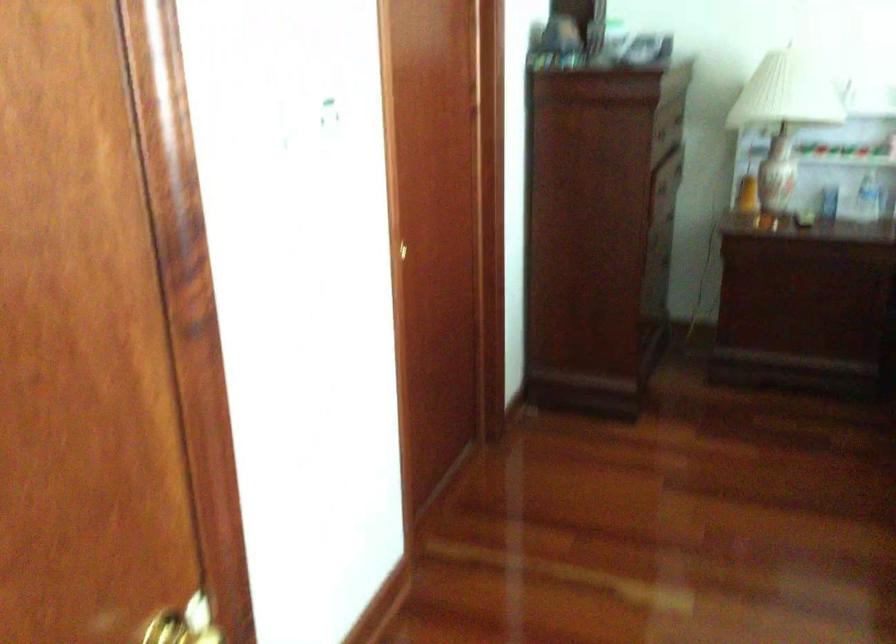
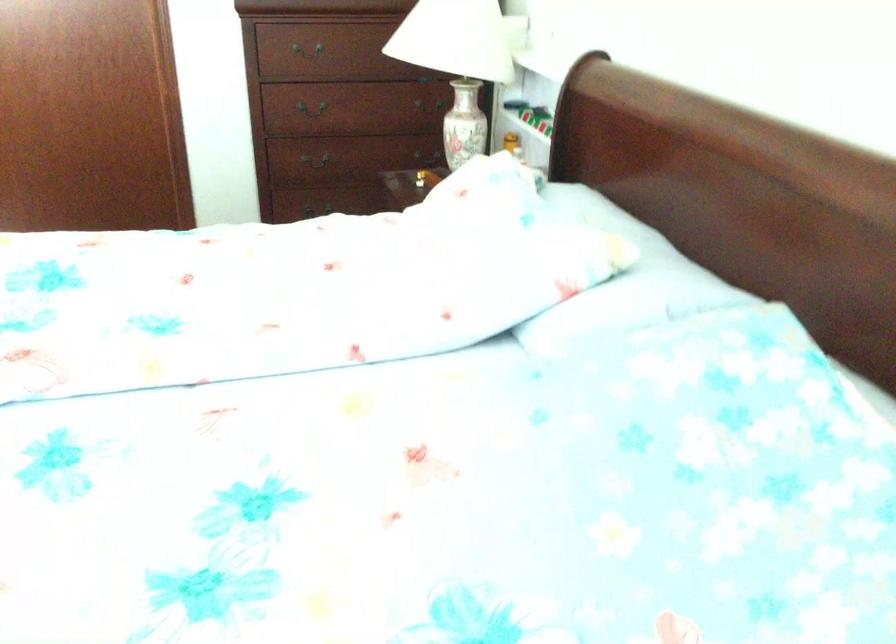
The point at (x=741, y=172) is marked in the first image. Where is the corresponding point in the second image?

(463, 124)